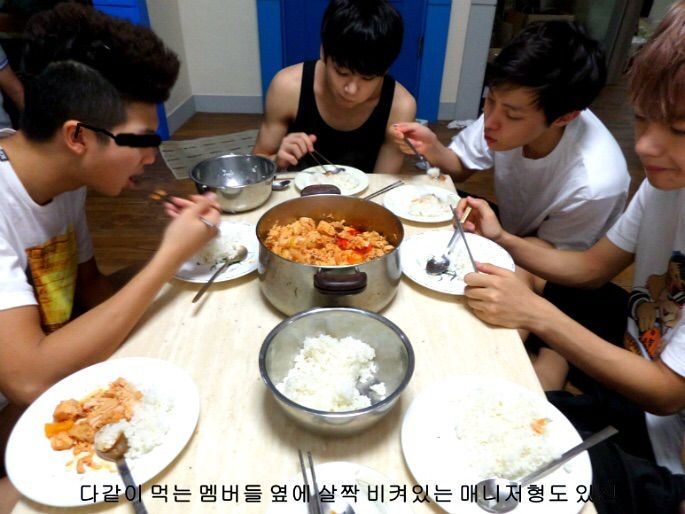
The height and width of the screenshot is (514, 685). I want to click on white wall, so click(x=216, y=44).